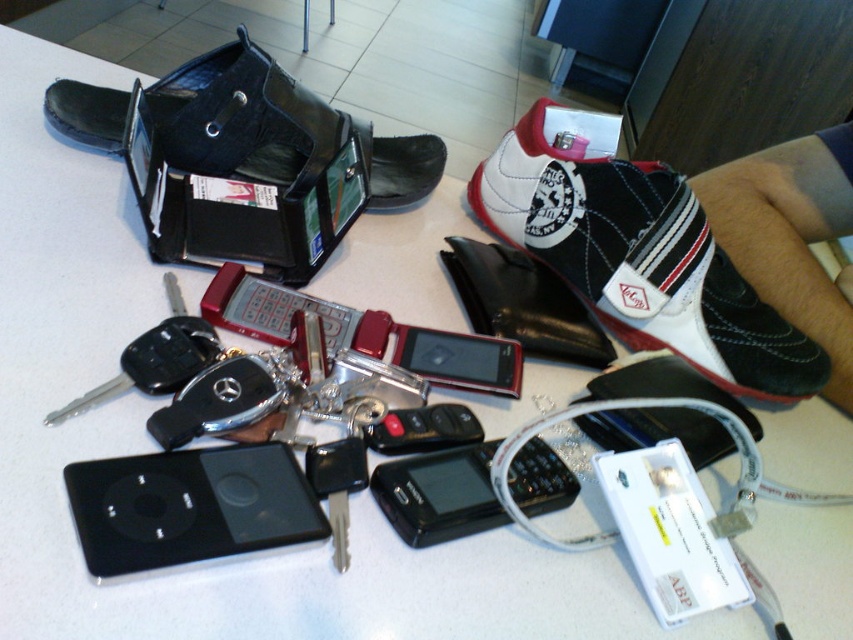
Which is more to the left, black matte/ipod at lower left or black leather wallet at upper left?

Positioned to the left is black leather wallet at upper left.

Is point (294, 493) closer to camera compared to point (403, 192)?

Yes, point (294, 493) is closer to viewer.

Where is `black matte/ipod at lower left`? The height and width of the screenshot is (640, 853). black matte/ipod at lower left is located at coordinates (189, 506).

Does black plastic ipod at lower center have a lesser height compared to black leather wallet at upper left?

Yes, black plastic ipod at lower center is shorter than black leather wallet at upper left.

Identify the location of black plastic ipod at lower center. (671, 532).

Does black matte/ipod at lower left appear on the right side of black matte smartphone at center?

Incorrect, black matte/ipod at lower left is not on the right side of black matte smartphone at center.

How distant is black matte/ipod at lower left from black matte smartphone at center?

black matte/ipod at lower left and black matte smartphone at center are 4.20 inches apart from each other.

Who is more distant from viewer, (x=187, y=516) or (x=422, y=518)?

The point (x=422, y=518) is behind.

The width and height of the screenshot is (853, 640). Find the location of `black matte/ipod at lower left`. black matte/ipod at lower left is located at coordinates (189, 506).